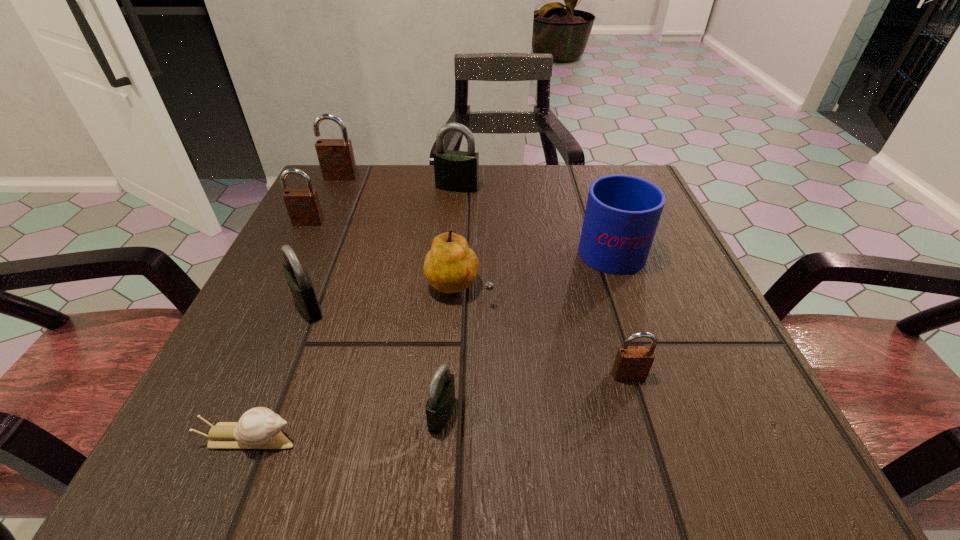
The height and width of the screenshot is (540, 960). I want to click on mug present at the right edge, so click(x=622, y=213).

You are a GUI agent. You are given a task and a screenshot of the screen. Output one action in this format:
    pyautogui.click(x=<x>, y=<y>)
    Task: Click on the padlock present at the right edge
    This screenshot has width=960, height=540.
    Given the screenshot: What is the action you would take?
    pyautogui.click(x=632, y=363)

Where is `object that is at the near left corner`? The height and width of the screenshot is (540, 960). object that is at the near left corner is located at coordinates (258, 428).

What are the coordinates of `object that is positioned at the far right corner` in the screenshot? It's located at (622, 213).

The image size is (960, 540). I want to click on free spot at the far edge of the desktop, so click(x=524, y=205).

Find the location of a particular element. vacant space at the left edge of the desktop is located at coordinates (361, 267).

Find the location of `vacant space at the right edge of the desktop`. vacant space at the right edge of the desktop is located at coordinates (618, 278).

In the image, there is a desktop. What are the coordinates of `vacant space at the far left corner` in the screenshot? It's located at (349, 208).

Find the location of `free space at the near left corner of the desktop`. free space at the near left corner of the desktop is located at coordinates (288, 424).

At what (x,y) coordinates should I click in order to perform the action: click on free spot between the second nearest padlock and the third farthest padlock. Please return your answer as a coordinate pair (x, y). Looking at the image, I should click on (468, 299).